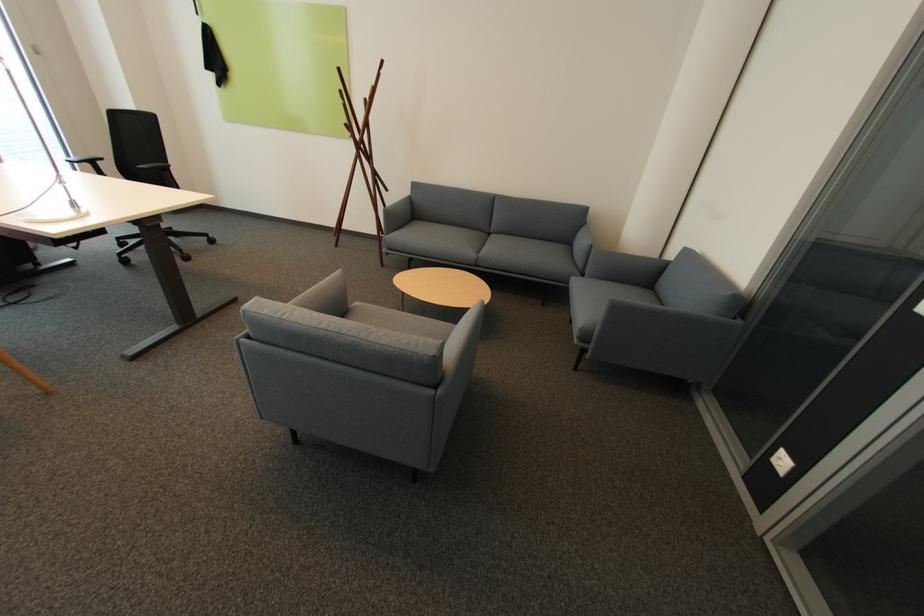
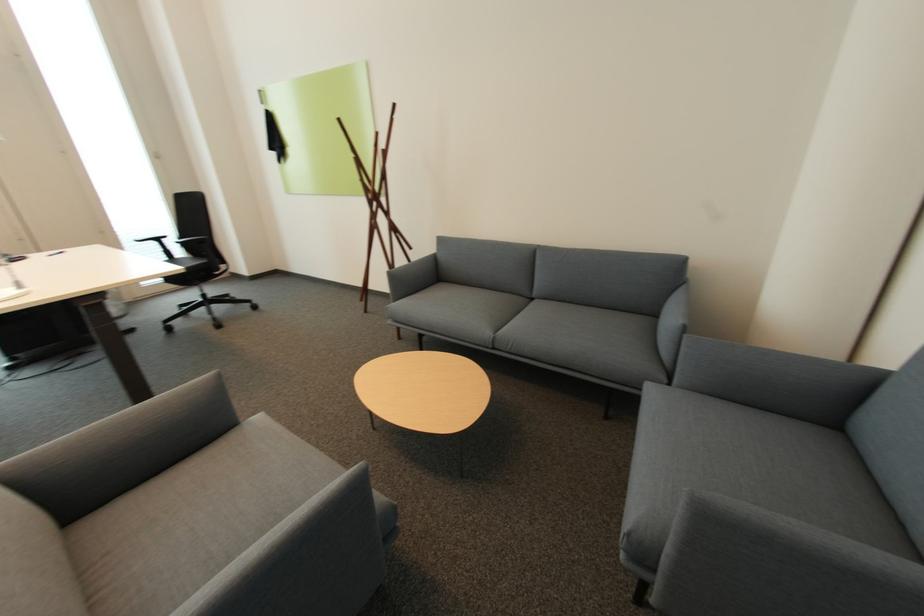
The images are taken continuously from a first-person perspective. In which direction are you moving?

The cameraman walked toward right, forward.